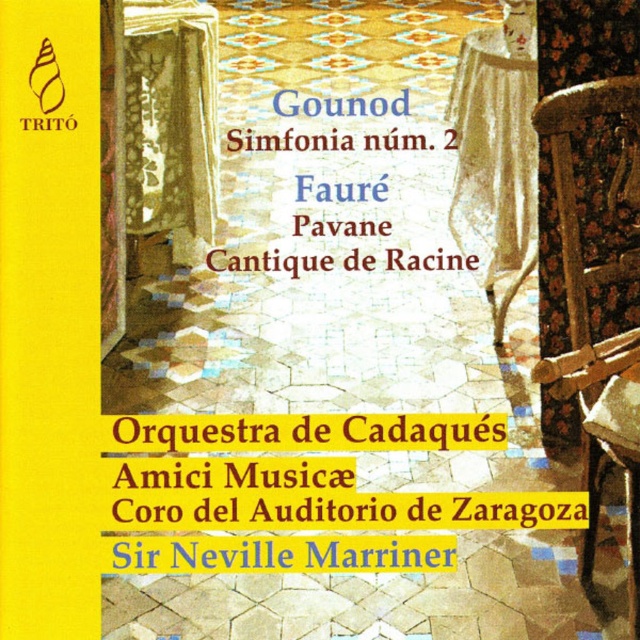
Is the position of wooden chair at right more distant than that of patterned fabric tablecloth at upper left?

No, it is not.

Is point (536, 369) positioned before point (177, 200)?

Yes, it is.

Identify the location of wooden chair at right. The width and height of the screenshot is (640, 640). [588, 314].

Which is behind, point (208, 196) or point (468, 76)?

The point (208, 196) is behind.

Does patterned fabric tablecloth at upper left have a greater height compared to white lace tablecloth at upper right?

In fact, patterned fabric tablecloth at upper left may be shorter than white lace tablecloth at upper right.

Is point (170, 147) behind point (513, 33)?

Yes, it is behind point (513, 33).

Where is `patterned fabric tablecloth at upper left`? The height and width of the screenshot is (640, 640). patterned fabric tablecloth at upper left is located at coordinates (172, 122).

Measure the distance between wooden chair at right and camera.

wooden chair at right is 2.52 meters from camera.

Which is in front, point (563, 378) or point (516, 285)?

Point (563, 378)

Where is `wooden chair at right`? wooden chair at right is located at coordinates (588, 314).